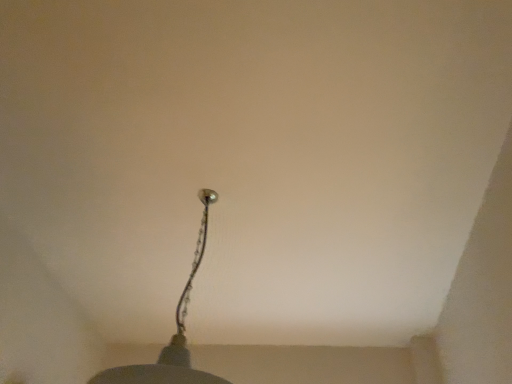
The width and height of the screenshot is (512, 384). Find the location of `metallic chain at upper center`. metallic chain at upper center is located at coordinates (173, 335).

Measure the distance between metallic chain at upper center and camera.

The distance of metallic chain at upper center from camera is 29.76 inches.

What do you see at coordinates (173, 335) in the screenshot? The height and width of the screenshot is (384, 512). I see `metallic chain at upper center` at bounding box center [173, 335].

The height and width of the screenshot is (384, 512). What are the coordinates of `metallic chain at upper center` in the screenshot? It's located at (173, 335).